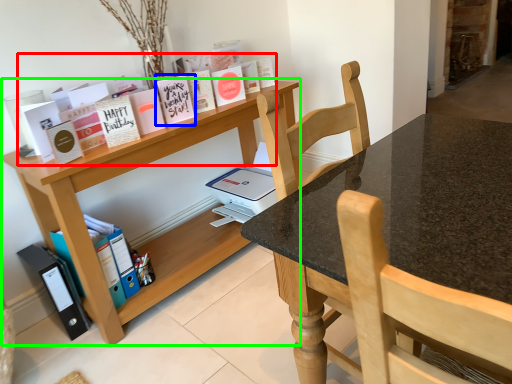
Question: Which object is positioned closest to book (highlighted by a red box)? Select from paperback book (highlighted by a blue box) and shelf (highlighted by a green box).

Choices:
 (A) paperback book
 (B) shelf

Answer: (A)